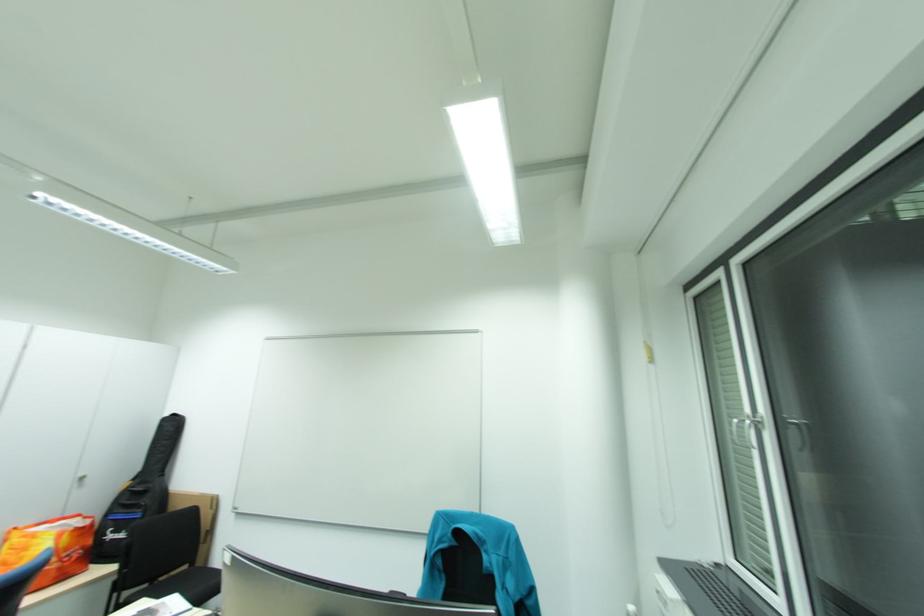
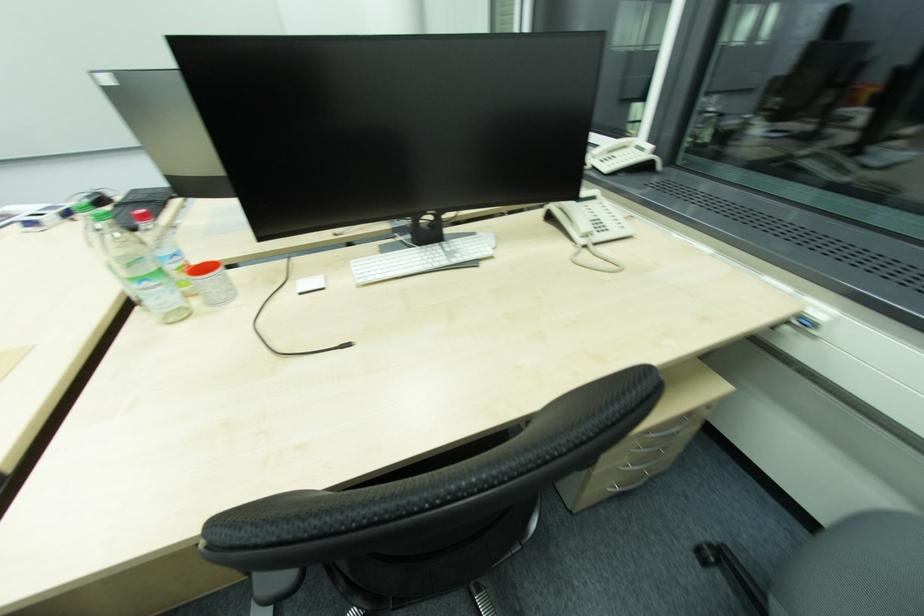
The first image is from the beginning of the video and the second image is from the end. How did the camera likely rotate when shooting the video?

The camera rotated toward right-down.